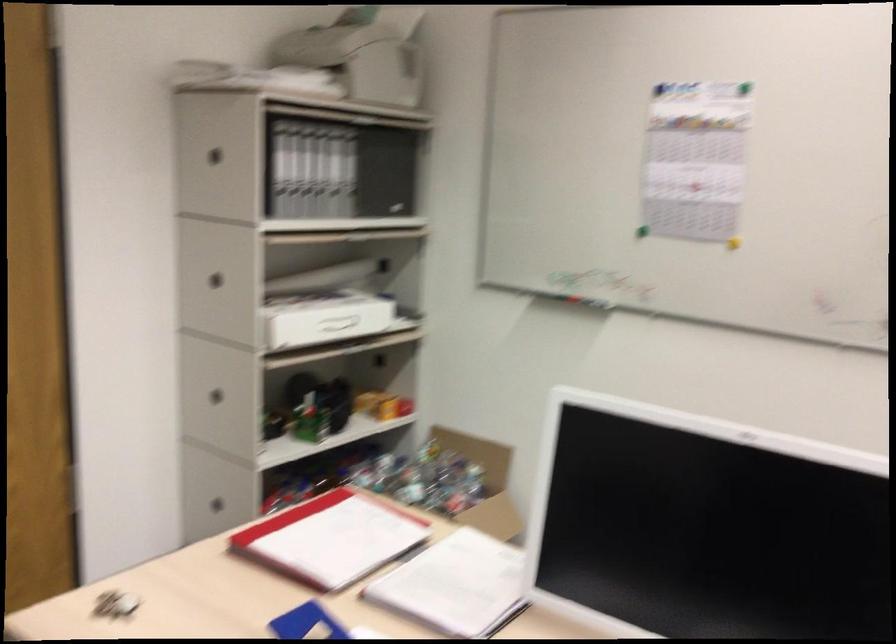
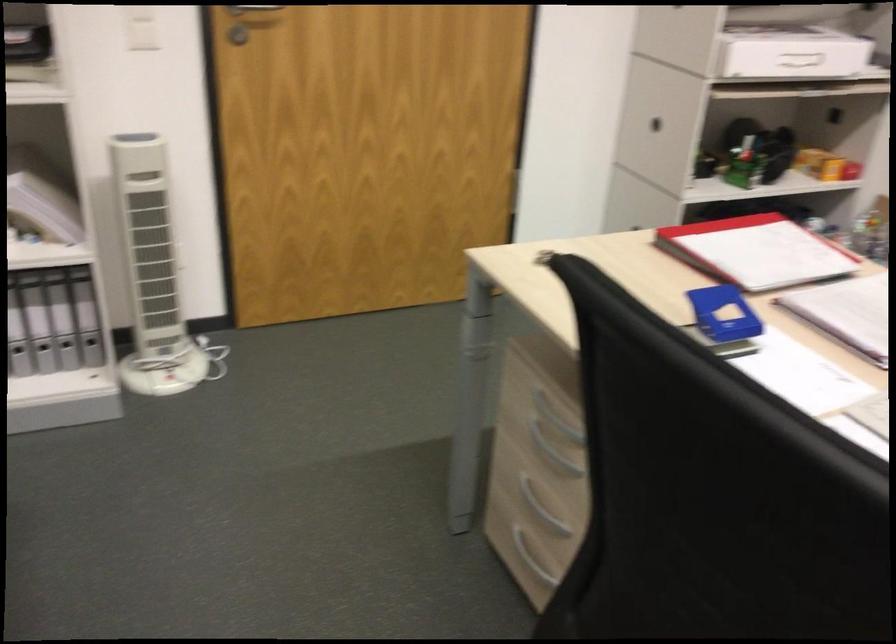
In the second image, find the point that corresponds to (x=324, y=317) in the first image.

(790, 53)